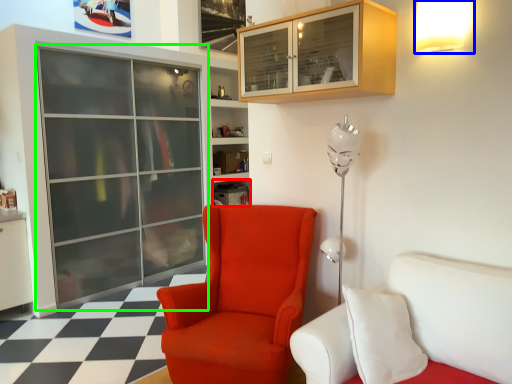
Question: Based on their relative distances, which object is nearer to shelf (highlighted by a red box)? Choose from light fixture (highlighted by a blue box) and screen door (highlighted by a green box).

Choices:
 (A) light fixture
 (B) screen door

Answer: (B)